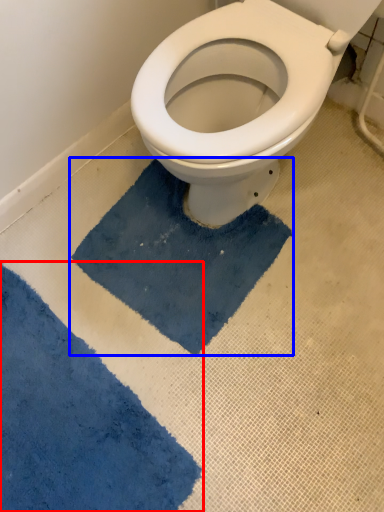
Question: Among these objects, which one is farthest to the camera, bath mat (highlighted by a red box) or bath mat (highlighted by a blue box)?

Choices:
 (A) bath mat
 (B) bath mat

Answer: (B)